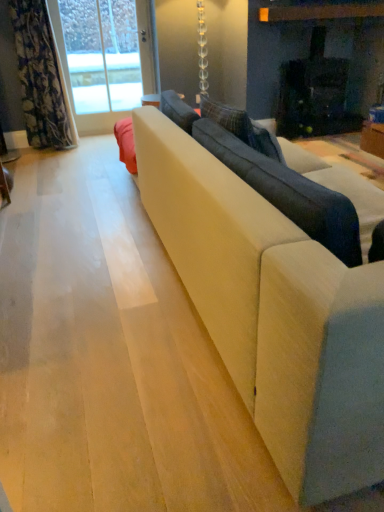
Question: Is clear glass door at upper left at the back of floral fabric curtain at left?

Choices:
 (A) yes
 (B) no

Answer: (B)

Question: Considering the relative sizes of floral fabric curtain at left and clear glass door at upper left in the image provided, is floral fabric curtain at left taller than clear glass door at upper left?

Choices:
 (A) yes
 (B) no

Answer: (B)

Question: Can you confirm if floral fabric curtain at left is positioned to the left of clear glass door at upper left?

Choices:
 (A) no
 (B) yes

Answer: (B)

Question: Is the position of floral fabric curtain at left less distant than that of clear glass door at upper left?

Choices:
 (A) yes
 (B) no

Answer: (A)

Question: From the image's perspective, is floral fabric curtain at left below clear glass door at upper left?

Choices:
 (A) yes
 (B) no

Answer: (A)

Question: Relative to clear glass door at upper left, is suede-like beige couch at center in front or behind?

Choices:
 (A) behind
 (B) front

Answer: (B)

Question: From a real-world perspective, is suede-like beige couch at center positioned above or below clear glass door at upper left?

Choices:
 (A) below
 (B) above

Answer: (A)

Question: In terms of size, does suede-like beige couch at center appear bigger or smaller than clear glass door at upper left?

Choices:
 (A) small
 (B) big

Answer: (B)

Question: In the image, is suede-like beige couch at center on the left side or the right side of clear glass door at upper left?

Choices:
 (A) left
 (B) right

Answer: (B)

Question: Is suede-like beige couch at center wider or thinner than floral fabric curtain at left?

Choices:
 (A) wide
 (B) thin

Answer: (B)

Question: In the image, is suede-like beige couch at center positioned in front of or behind floral fabric curtain at left?

Choices:
 (A) behind
 (B) front

Answer: (B)

Question: Is point (304, 188) positioned closer to the camera than point (16, 44)?

Choices:
 (A) closer
 (B) farther

Answer: (A)

Question: From a real-world perspective, is suede-like beige couch at center above or below floral fabric curtain at left?

Choices:
 (A) below
 (B) above

Answer: (A)

Question: Looking at the image, does suede-like beige couch at center seem bigger or smaller compared to clear glass door at upper left?

Choices:
 (A) big
 (B) small

Answer: (B)

Question: Visually, is suede-like beige couch at center positioned to the left or to the right of clear glass door at upper left?

Choices:
 (A) right
 (B) left

Answer: (A)